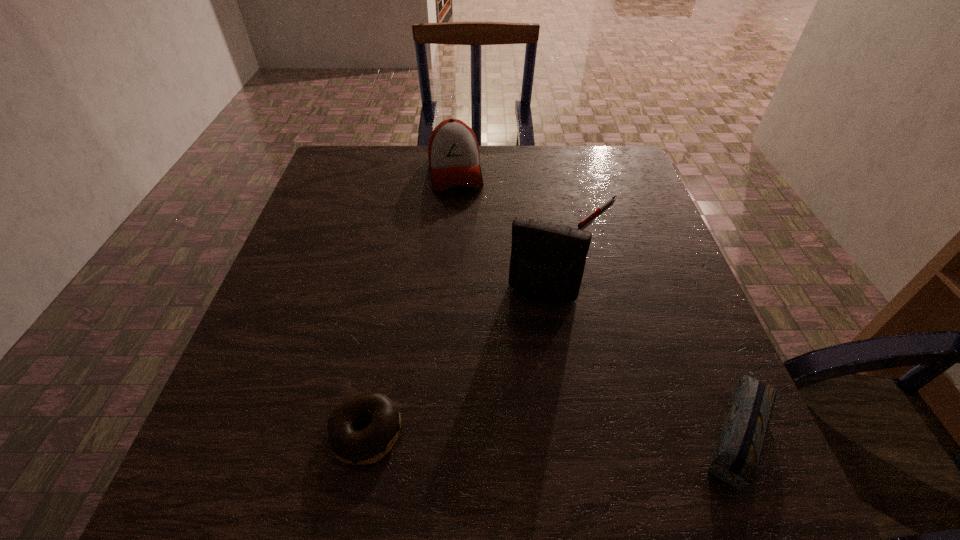
The width and height of the screenshot is (960, 540). I want to click on doughnut, so click(366, 446).

You are a GUI agent. You are given a task and a screenshot of the screen. Output one action in this format:
    pyautogui.click(x=<x>, y=<y>)
    Task: Click on the third tallest object
    
    Given the screenshot: What is the action you would take?
    pyautogui.click(x=736, y=460)

Where is `pen`? Image resolution: width=960 pixels, height=540 pixels. pen is located at coordinates (610, 200).

This screenshot has height=540, width=960. In order to click on the tallest object in this screenshot , I will do (547, 262).

At what (x,y) coordinates should I click in order to perform the action: click on the third object from right to left. Please return your answer as a coordinate pair (x, y). Looking at the image, I should click on (547, 262).

Image resolution: width=960 pixels, height=540 pixels. I want to click on baseball cap, so click(454, 157).

Locate an element on the screen. The height and width of the screenshot is (540, 960). blank space located on the back of the second shortest object is located at coordinates (382, 343).

Where is `vacant space located on the left of the pencil box`? vacant space located on the left of the pencil box is located at coordinates (641, 427).

Find the location of a particular element. The image size is (960, 540). free spot located 0.360m on the clicker of the pen is located at coordinates (589, 346).

The image size is (960, 540). Find the location of `blank area located 0.060m on the clicker of the pen`. blank area located 0.060m on the clicker of the pen is located at coordinates (596, 244).